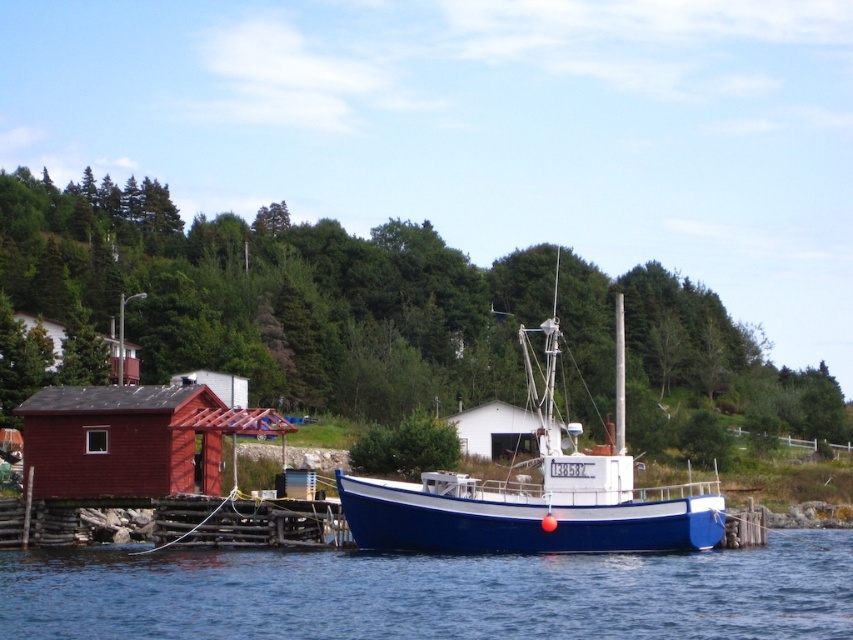
Does blue water at center come in front of blue matte boat at center?

Yes, blue water at center is in front of blue matte boat at center.

How far apart are blue water at center and blue matte boat at center?

blue water at center is 41.22 feet from blue matte boat at center.

Which is in front, point (512, 573) or point (373, 525)?

Point (512, 573) is more forward.

Where is `blue water at center`? Image resolution: width=853 pixels, height=640 pixels. blue water at center is located at coordinates (433, 593).

Does point (181, 385) come in front of point (465, 451)?

That is True.

Does smooth red cabin at lower left appear on the right side of white matte hut at center?

In fact, smooth red cabin at lower left is to the left of white matte hut at center.

Find the location of `smooth red cabin at lower left`. smooth red cabin at lower left is located at coordinates (131, 440).

Who is higher up, blue water at center or white matte hut at center?

Positioned higher is white matte hut at center.

Does blue water at center lie behind white matte hut at center?

That is False.

Is point (6, 609) farther from viewer compared to point (486, 451)?

No, it is not.

Find the location of a particular element. The image size is (853, 640). blue water at center is located at coordinates (433, 593).